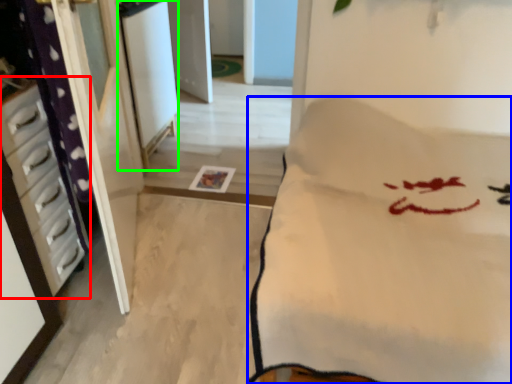
Question: Which object is the closest to the furniture (highlighted by a red box)? Choose among these: furniture (highlighted by a blue box) or screen door (highlighted by a green box).

Choices:
 (A) furniture
 (B) screen door

Answer: (A)